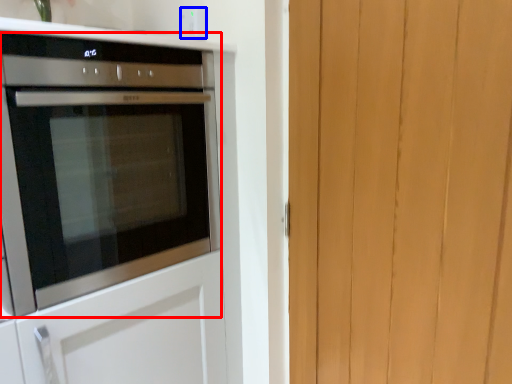
Question: Which object is closer to the camera taking this photo, oven (highlighted by a red box) or electric outlet (highlighted by a blue box)?

Choices:
 (A) oven
 (B) electric outlet

Answer: (A)